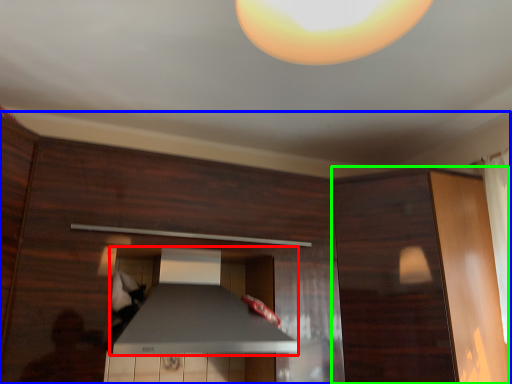
Question: Considering the real-world distances, which object is closest to exhaust hood (highlighted by a red box)? dresser (highlighted by a blue box) or cabinetry (highlighted by a green box).

Choices:
 (A) dresser
 (B) cabinetry

Answer: (A)